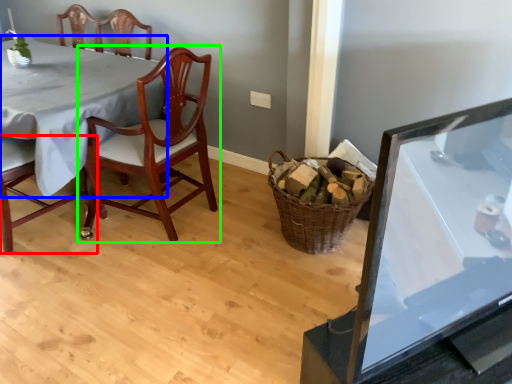
Question: Which object is the farthest from chair (highlighted by a red box)? Choose among these: table (highlighted by a blue box) or chair (highlighted by a green box).

Choices:
 (A) table
 (B) chair

Answer: (B)